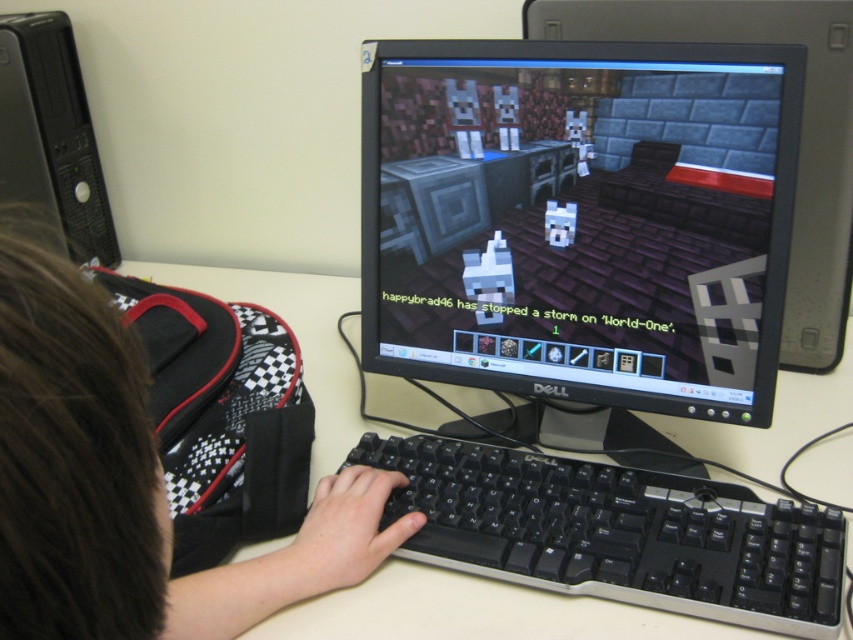
You are standing in front of the computer monitor and want to place a small sticker on the screen. You have two points to choose from on the monitor screen. Which point is closer to you, point (637,518) or point (714,20)?

Point (637,518) is closer to the viewer than point (714,20).

Consider the image. You are a gamer who wants to place a new mouse pad between the black plastic keyboard at center and the black glossy monitor at center. Based on their positions, which object should the mouse pad be placed closer to?

The mouse pad should be placed closer to the black glossy monitor at center because the black plastic keyboard at center is in front of it, meaning the monitor is behind the keyboard. Placing the mouse pad behind the keyboard towards the monitor would utilize the space effectively.

You are setting up a home office and need to place the black plastic tower at left and the white plastic computer desk at center. Given their sizes, which object should you place first to ensure proper positioning?

The black plastic tower at left is smaller than the white plastic computer desk at center, so you should place the white plastic computer desk at center first to accommodate the larger object and ensure proper positioning.